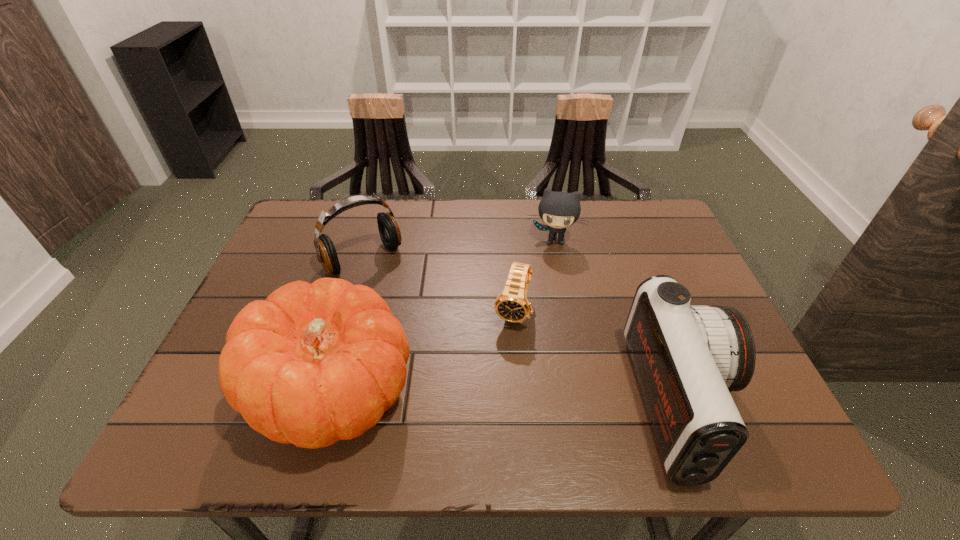
This screenshot has height=540, width=960. I want to click on vacant space that's between the camcorder and the headset, so click(522, 332).

You are a GUI agent. You are given a task and a screenshot of the screen. Output one action in this format:
    pyautogui.click(x=<x>, y=<y>)
    Task: Click on the free space between the camcorder and the pumpkin
    The width and height of the screenshot is (960, 540).
    Given the screenshot: What is the action you would take?
    pyautogui.click(x=508, y=398)

This screenshot has height=540, width=960. I want to click on free space between the second shortest object and the headset, so click(x=459, y=250).

Point out which object is positioned as the nearest to the camcorder. Please provide its 2D coordinates. Your answer should be formatted as a tuple, i.e. [(x, y)], where the tuple contains the x and y coordinates of a point satisfying the conditions above.

[(512, 305)]

Where is `the closest object to the shortest object`? This screenshot has height=540, width=960. the closest object to the shortest object is located at coordinates (558, 210).

Locate an element on the screen. The image size is (960, 540). free space in the image that satisfies the following two spatial constraints: 1. on the front side of the third object from right to left; 2. on the surface of the camcorder is located at coordinates (519, 404).

Where is `free location that satisfies the following two spatial constraints: 1. on the front side of the headset; 2. on the surface of the camcorder`? free location that satisfies the following two spatial constraints: 1. on the front side of the headset; 2. on the surface of the camcorder is located at coordinates (320, 404).

In order to click on free location that satisfies the following two spatial constraints: 1. on the back side of the kitten; 2. on the left side of the watch in this screenshot , I will do `click(508, 241)`.